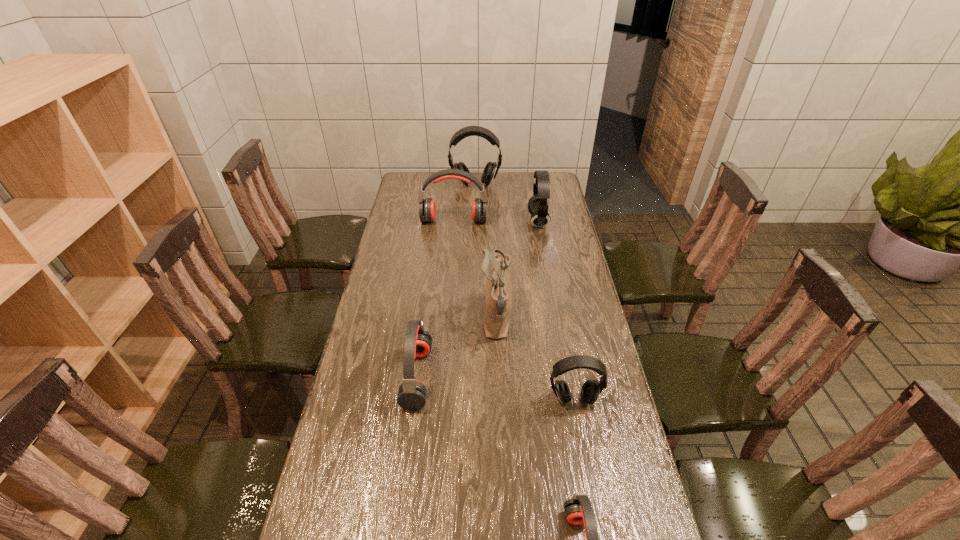
Identify the location of black earphone that is the second closest one to the smallest red earphone. Image resolution: width=960 pixels, height=540 pixels. (538, 206).

At what (x,y) coordinates should I click in order to perform the action: click on red earphone that is the closest to the second farthest red earphone. Please return your answer as a coordinate pair (x, y). This screenshot has width=960, height=540. Looking at the image, I should click on (578, 510).

Find the location of a particular element. The image size is (960, 540). the closest red earphone to the second nearest red earphone is located at coordinates (578, 510).

Where is `free spot that satisfies the following two spatial constraints: 1. on the ear cups of the farthest red earphone; 2. on the ear cups of the second smallest red earphone`? The width and height of the screenshot is (960, 540). free spot that satisfies the following two spatial constraints: 1. on the ear cups of the farthest red earphone; 2. on the ear cups of the second smallest red earphone is located at coordinates (442, 377).

At what (x,y) coordinates should I click in order to perform the action: click on blank space that satisfies the following two spatial constraints: 1. on the ear cups of the tallest earphone; 2. on the ear cups of the second nearest red earphone. Please return your answer as a coordinate pair (x, y). Image resolution: width=960 pixels, height=540 pixels. Looking at the image, I should click on (472, 377).